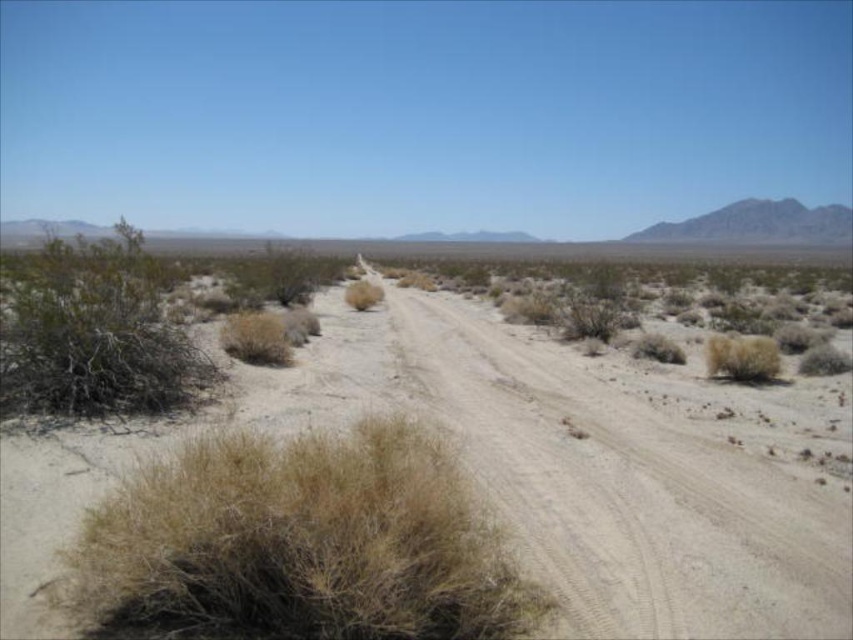
You are a hiker trying to navigate the desert. You see the dusty sand at center and the dry grass at lower left. Which of these two landmarks is closer to your current position?

The dry grass at lower left is behind the dusty sand at center, so the dusty sand at center is closer to your current position.

Consider the image. You are a hiker who has lost your way in the desert. You see a point marked at coordinate (299,544). According to the map, this point indicates dry grass at lower left. Considering the desert environment described, would you prioritize this area for finding water?

The point at coordinate (299,544) indicates dry grass at lower left. Since dry grass typically grows in areas with limited water, it might not be the best indicator for finding water in the desert environment described. You should look for areas with greener vegetation or signs of moisture instead.